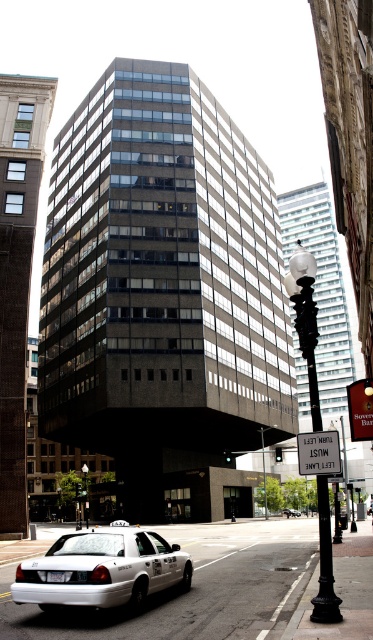
Who is shorter, white glossy taxi at lower left or glass transparent lamp post at center?

white glossy taxi at lower left

This screenshot has width=373, height=640. What do you see at coordinates (102, 570) in the screenshot?
I see `white glossy taxi at lower left` at bounding box center [102, 570].

Locate an element on the screen. The width and height of the screenshot is (373, 640). white glossy taxi at lower left is located at coordinates (102, 570).

This screenshot has height=640, width=373. In order to click on black wrought iron streetlamp at center right in this screenshot , I will do `click(305, 320)`.

The width and height of the screenshot is (373, 640). Describe the element at coordinates (305, 320) in the screenshot. I see `black wrought iron streetlamp at center right` at that location.

Is point (321, 621) less distant than point (264, 492)?

Yes, point (321, 621) is closer to viewer.

This screenshot has height=640, width=373. I want to click on black wrought iron streetlamp at center right, so pyautogui.click(x=305, y=320).

Can you confirm if white glossy taxi at lower left is shorter than black wrought iron streetlamp at center right?

Yes, white glossy taxi at lower left is shorter than black wrought iron streetlamp at center right.

Is point (110, 595) more distant than point (327, 497)?

No, (110, 595) is in front of (327, 497).

Is point (91, 592) positioned after point (324, 556)?

Yes.

You are a GUI agent. You are given a task and a screenshot of the screen. Output one action in this format:
    pyautogui.click(x=<x>, y=<y>)
    Task: Click on the white glossy taxi at lower left
    
    Given the screenshot: What is the action you would take?
    pyautogui.click(x=102, y=570)